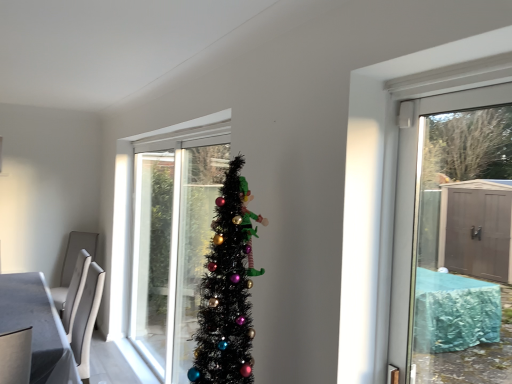
Question: Is transparent glass door at upper right inside or outside of white glossy table at lower left?

Choices:
 (A) inside
 (B) outside

Answer: (B)

Question: In terms of height, does transparent glass door at upper right look taller or shorter compared to white glossy table at lower left?

Choices:
 (A) short
 (B) tall

Answer: (B)

Question: Considering their positions, is transparent glass door at upper right located in front of or behind white glossy table at lower left?

Choices:
 (A) front
 (B) behind

Answer: (A)

Question: Considering the relative positions of white glossy table at lower left and transparent glass door at upper right in the image provided, is white glossy table at lower left to the left or to the right of transparent glass door at upper right?

Choices:
 (A) right
 (B) left

Answer: (B)

Question: Considering the positions of white glossy table at lower left and transparent glass door at upper right in the image, is white glossy table at lower left bigger or smaller than transparent glass door at upper right?

Choices:
 (A) small
 (B) big

Answer: (B)

Question: Is point (36, 365) closer or farther from the camera than point (417, 187)?

Choices:
 (A) closer
 (B) farther

Answer: (B)

Question: Is white glossy table at lower left taller or shorter than transparent glass door at upper right?

Choices:
 (A) short
 (B) tall

Answer: (A)